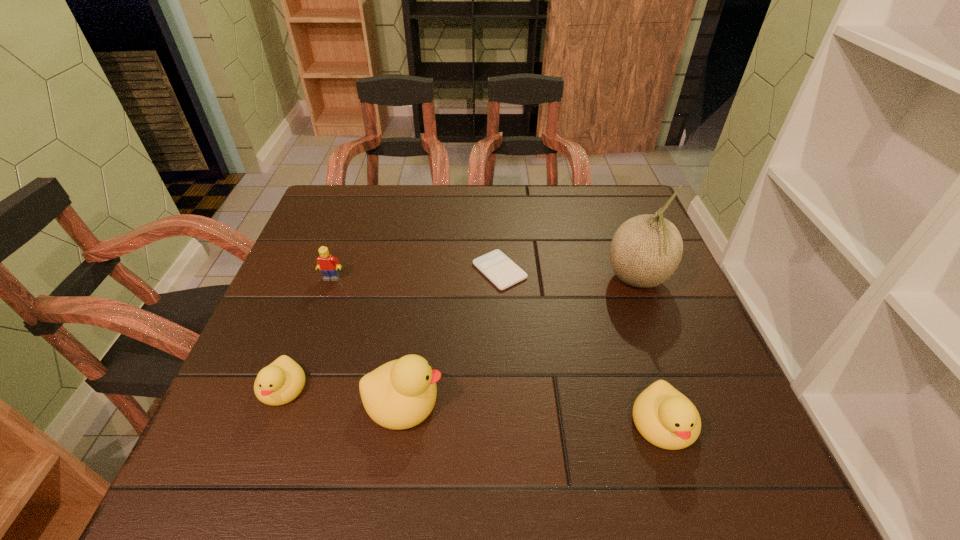
If the aim is uniform spacing by inserting an additional duckling among them, please point to a vacant space for this new duckling. Please provide its 2D coordinates. Your answer should be formatted as a tuple, i.e. [(x, y)], where the tuple contains the x and y coordinates of a point satisfying the conditions above.

[(531, 411)]